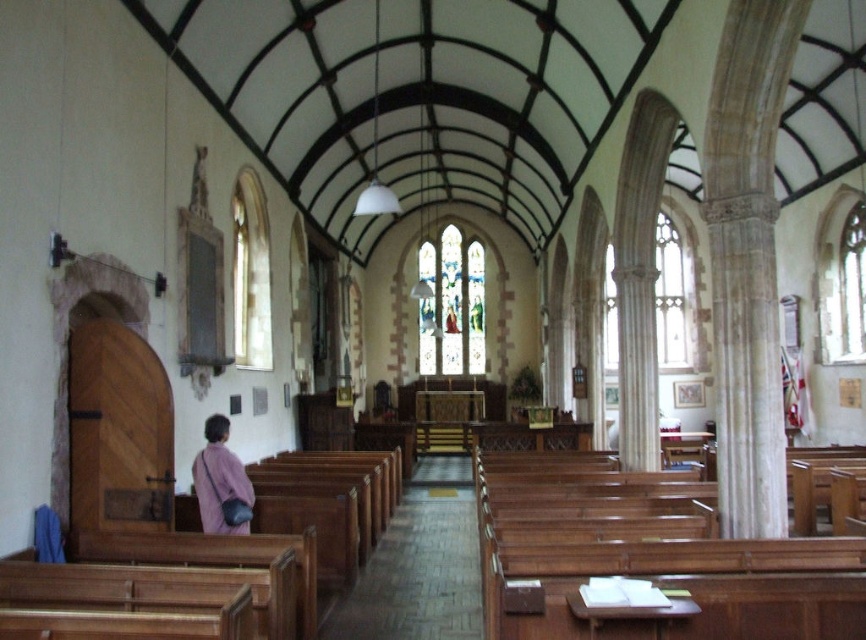
Question: Can you confirm if brown wooden aisle at center is thinner than pink fabric bag at lower left?

Choices:
 (A) no
 (B) yes

Answer: (A)

Question: In this image, where is brown wooden aisle at center located relative to pink fabric bag at lower left?

Choices:
 (A) left
 (B) right

Answer: (B)

Question: Which of the following is the closest to the observer?

Choices:
 (A) (443, 612)
 (B) (210, 433)

Answer: (A)

Question: Among these points, which one is nearest to the camera?

Choices:
 (A) (480, 602)
 (B) (218, 461)

Answer: (B)

Question: Is brown wooden aisle at center to the left of pink fabric bag at lower left from the viewer's perspective?

Choices:
 (A) yes
 (B) no

Answer: (B)